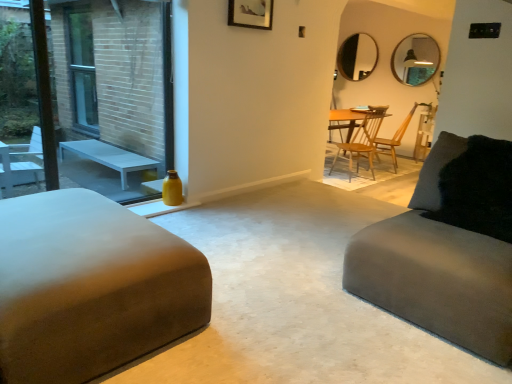
The height and width of the screenshot is (384, 512). What do you see at coordinates (90, 287) in the screenshot? I see `suede-like beige ottoman at left, acting as the second studio couch starting from the right` at bounding box center [90, 287].

In order to face matte black mirror at upper center, which appears as the 2th mirror when viewed from the right, should I rotate leftwards or rightwards?

A 13.408 degree turn to the right will do.

Describe the element at coordinates (357, 57) in the screenshot. I see `matte black mirror at upper center, arranged as the 1th mirror when viewed from the left` at that location.

The width and height of the screenshot is (512, 384). What do you see at coordinates (394, 140) in the screenshot? I see `wooden chair at center, which ranks as the first chair in right-to-left order` at bounding box center [394, 140].

You are a GUI agent. You are given a task and a screenshot of the screen. Output one action in this format:
    pyautogui.click(x=<x>, y=<y>)
    Task: Click on the suede-like beige ottoman at left, marked as the first studio couch in a left-to-right arrangement
    This screenshot has width=512, height=384.
    Given the screenshot: What is the action you would take?
    pyautogui.click(x=90, y=287)

Considering the relative sizes of suede-like beige ottoman at left, marked as the first studio couch in a left-to-right arrangement, and black fuzzy pillow at right in the image provided, is suede-like beige ottoman at left, marked as the first studio couch in a left-to-right arrangement, smaller than black fuzzy pillow at right?

Actually, suede-like beige ottoman at left, marked as the first studio couch in a left-to-right arrangement, might be larger than black fuzzy pillow at right.

From the image's perspective, which studio couch is the 2nd one below the black fuzzy pillow at right? Please provide its 2D coordinates.

[(90, 287)]

From a real-world perspective, is suede-like beige ottoman at left, acting as the second studio couch starting from the right, physically located above or below black fuzzy pillow at right?

Clearly, from a real-world perspective, suede-like beige ottoman at left, acting as the second studio couch starting from the right, is below black fuzzy pillow at right.

From the image's perspective, who appears lower, suede-like beige ottoman at left, acting as the second studio couch starting from the right, or black fuzzy pillow at right?

From the image's view, suede-like beige ottoman at left, acting as the second studio couch starting from the right, is below.

Is wooden chair at center, which ranks as the first chair in right-to-left order, turned away from matte black mirror at upper center, which appears as the 2th mirror when viewed from the right?

That's not correct — wooden chair at center, which ranks as the first chair in right-to-left order, is not looking away from matte black mirror at upper center, which appears as the 2th mirror when viewed from the right.

Does wooden chair at center, which is counted as the 2th chair, starting from the left, have a smaller size compared to matte black mirror at upper center, marked as the first mirror in a back-to-front arrangement?

Actually, wooden chair at center, which is counted as the 2th chair, starting from the left, might be larger than matte black mirror at upper center, marked as the first mirror in a back-to-front arrangement.

Which of these two, wooden chair at center, which ranks as the first chair in right-to-left order, or matte black mirror at upper center, marked as the first mirror in a back-to-front arrangement, stands shorter?

Standing shorter between the two is matte black mirror at upper center, marked as the first mirror in a back-to-front arrangement.

Do you think wooden chair at center, which is counted as the 2th chair, starting from the left, is within matte black mirror at upper center, which appears as the 2th mirror when viewed from the right, or outside of it?

wooden chair at center, which is counted as the 2th chair, starting from the left, is spatially situated outside matte black mirror at upper center, which appears as the 2th mirror when viewed from the right.

Between matte black mirror at upper center, the 2th mirror from the front, and matte silver picture frame at upper center, which one has more height?

Standing taller between the two is matte black mirror at upper center, the 2th mirror from the front.

Is matte black mirror at upper center, which appears as the 2th mirror when viewed from the right, facing away from matte silver picture frame at upper center?

That's not correct — matte black mirror at upper center, which appears as the 2th mirror when viewed from the right, is not looking away from matte silver picture frame at upper center.

Would you say matte black mirror at upper center, marked as the first mirror in a back-to-front arrangement, is inside or outside matte silver picture frame at upper center?

matte black mirror at upper center, marked as the first mirror in a back-to-front arrangement, is outside matte silver picture frame at upper center.

Can you confirm if matte black mirror at upper center, which appears as the 2th mirror when viewed from the right, is positioned to the left of matte silver picture frame at upper center?

Incorrect, matte black mirror at upper center, which appears as the 2th mirror when viewed from the right, is not on the left side of matte silver picture frame at upper center.

Looking at this image, how many degrees apart are the facing directions of wooden chair at center, which is counted as the 2th chair, starting from the left, and wooden chair at center, which is the second chair from right to left?

wooden chair at center, which is counted as the 2th chair, starting from the left, and wooden chair at center, which is the second chair from right to left, are facing 42.9 degrees away from each other.

This screenshot has width=512, height=384. I want to click on chair that is above the wooden chair at center, the first chair from the left (from a real-world perspective), so click(394, 140).

From a real-world perspective, is wooden chair at center, which ranks as the first chair in right-to-left order, positioned over wooden chair at center, the first chair from the left, based on gravity?

Indeed, from a real-world perspective, wooden chair at center, which ranks as the first chair in right-to-left order, stands above wooden chair at center, the first chair from the left.

Is suede-like beige ottoman at left, acting as the second studio couch starting from the right, next to wooden chair at center, the first chair from the left?

Result: There is a gap between suede-like beige ottoman at left, acting as the second studio couch starting from the right, and wooden chair at center, the first chair from the left.

Is suede-like beige ottoman at left, acting as the second studio couch starting from the right, surrounding wooden chair at center, which is the second chair from right to left?

No, wooden chair at center, which is the second chair from right to left, is not a part of suede-like beige ottoman at left, acting as the second studio couch starting from the right.

Considering the relative positions of suede-like beige ottoman at left, marked as the first studio couch in a left-to-right arrangement, and wooden chair at center, which is the second chair from right to left, in the image provided, is suede-like beige ottoman at left, marked as the first studio couch in a left-to-right arrangement, to the left of wooden chair at center, which is the second chair from right to left, from the viewer's perspective?

Yes.

Which is more distant, (95, 213) or (379, 115)?

The point (379, 115) is more distant.

In the scene shown: From the image's perspective, is matte silver picture frame at upper center located above or below black fuzzy pillow at right?

matte silver picture frame at upper center is above black fuzzy pillow at right.

In the scene shown: Which of these two, matte silver picture frame at upper center or black fuzzy pillow at right, stands taller?

Standing taller between the two is black fuzzy pillow at right.

Is matte silver picture frame at upper center directly adjacent to black fuzzy pillow at right?

matte silver picture frame at upper center and black fuzzy pillow at right are clearly separated.

Is matte silver picture frame at upper center oriented away from black fuzzy pillow at right?

No, matte silver picture frame at upper center's orientation is not away from black fuzzy pillow at right.

In the scene shown: Considering the relative sizes of matte black mirror at upper center, which appears as the 2th mirror when viewed from the right, and yellow glass bottle at left in the image provided, is matte black mirror at upper center, which appears as the 2th mirror when viewed from the right, smaller than yellow glass bottle at left?

Indeed, matte black mirror at upper center, which appears as the 2th mirror when viewed from the right, has a smaller size compared to yellow glass bottle at left.

Is matte black mirror at upper center, which appears as the 2th mirror when viewed from the right, positioned with its back to yellow glass bottle at left?

No, yellow glass bottle at left is not at the back of matte black mirror at upper center, which appears as the 2th mirror when viewed from the right.

Is matte black mirror at upper center, arranged as the 1th mirror when viewed from the left, not within yellow glass bottle at left?

matte black mirror at upper center, arranged as the 1th mirror when viewed from the left, is positioned outside yellow glass bottle at left.

From a real-world perspective, which is physically above, matte black mirror at upper center, which appears as the 2th mirror when viewed from the right, or yellow glass bottle at left?

matte black mirror at upper center, which appears as the 2th mirror when viewed from the right, from a real-world perspective.

From the image's perspective, count 2nd studio couchs downward from the black fuzzy pillow at right and point to it. Please provide its 2D coordinates.

[(90, 287)]

Find the location of a particular element. This screenshot has width=512, height=384. the 1st chair directly beneath the matte black mirror at upper center, marked as the first mirror in a back-to-front arrangement (from a real-world perspective) is located at coordinates click(394, 140).

When comparing their distances from matte black mirror at upper right, the second mirror positioned from the left, does suede-like beige ottoman at left, acting as the second studio couch starting from the right, or matte black mirror at upper center, arranged as the 1th mirror when viewed from the left, seem closer?

Among the two, matte black mirror at upper center, arranged as the 1th mirror when viewed from the left, is located nearer to matte black mirror at upper right, the second mirror positioned from the left.

When comparing their distances from wooden chair at center, which ranks as the first chair in right-to-left order, does suede-like beige ottoman at left, marked as the first studio couch in a left-to-right arrangement, or matte black mirror at upper right, the 1th mirror viewed from the right, seem closer?

matte black mirror at upper right, the 1th mirror viewed from the right, lies closer to wooden chair at center, which ranks as the first chair in right-to-left order, than the other object.

Consider the image. Estimate the real-world distances between objects in this image. Which object is closer to yellow glass bottle at left, wooden chair at center, which is the second chair from right to left, or matte black mirror at upper center, the 2th mirror from the front?

wooden chair at center, which is the second chair from right to left, is positioned closer to the anchor yellow glass bottle at left.

From the image, which object appears to be nearer to matte silver picture frame at upper center, suede-like beige ottoman at left, marked as the first studio couch in a left-to-right arrangement, or matte black mirror at upper center, which appears as the 2th mirror when viewed from the right?

The object closer to matte silver picture frame at upper center is suede-like beige ottoman at left, marked as the first studio couch in a left-to-right arrangement.

Considering their positions, is matte silver picture frame at upper center positioned closer to black fuzzy pillow at right than matte black mirror at upper right, the second mirror positioned from the left?

The object closer to black fuzzy pillow at right is matte silver picture frame at upper center.

Looking at the image, which one is located closer to suede gray couch at right, marked as the 2th studio couch in a left-to-right arrangement, matte black mirror at upper center, arranged as the 1th mirror when viewed from the left, or black fuzzy pillow at right?

The object closer to suede gray couch at right, marked as the 2th studio couch in a left-to-right arrangement, is black fuzzy pillow at right.

Estimate the real-world distances between objects in this image. Which object is further from matte silver picture frame at upper center, matte black mirror at upper right, the 2th mirror positioned from the back, or wooden chair at center, the first chair from the left?

The object further to matte silver picture frame at upper center is matte black mirror at upper right, the 2th mirror positioned from the back.

Based on their spatial positions, is yellow glass bottle at left or suede gray couch at right, the 1th studio couch from the right, further from matte silver picture frame at upper center?

suede gray couch at right, the 1th studio couch from the right.

The height and width of the screenshot is (384, 512). Find the location of `screen door between suede-like beige ottoman at left, marked as the first studio couch in a left-to-right arrangement, and matte silver picture frame at upper center in the front-back direction`. screen door between suede-like beige ottoman at left, marked as the first studio couch in a left-to-right arrangement, and matte silver picture frame at upper center in the front-back direction is located at coordinates (115, 92).

Find the location of a particular element. Image resolution: width=512 pixels, height=384 pixels. chair between suede gray couch at right, the 1th studio couch from the right, and wooden chair at center, which ranks as the first chair in right-to-left order, in the front-back direction is located at coordinates (359, 136).

The image size is (512, 384). In order to click on picture frame located between black fuzzy pillow at right and wooden chair at center, which ranks as the first chair in right-to-left order, in the depth direction in this screenshot , I will do `click(250, 13)`.

This screenshot has height=384, width=512. Find the location of `picture frame between suede gray couch at right, marked as the 2th studio couch in a left-to-right arrangement, and wooden chair at center, which ranks as the first chair in right-to-left order, from front to back`. picture frame between suede gray couch at right, marked as the 2th studio couch in a left-to-right arrangement, and wooden chair at center, which ranks as the first chair in right-to-left order, from front to back is located at coordinates (250, 13).